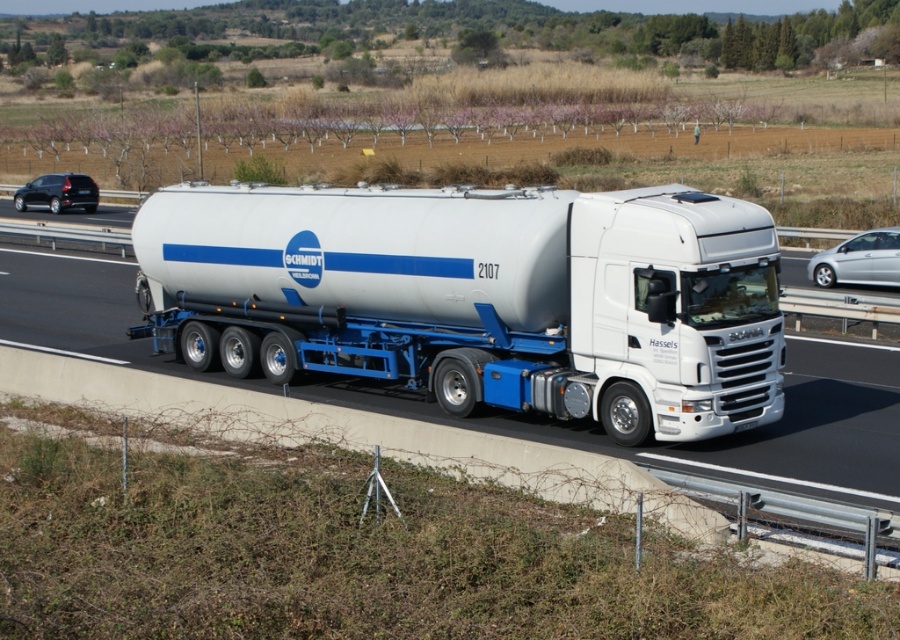
You are a pedestrian standing on the sidewalk and see the white glossy tanker at center and the black matte car at left. Which vehicle is closer to your right side?

The white glossy tanker at center is closer to your right side because it is positioned to the right of the black matte car at left.

You are standing at a safe distance from the tanker truck. You want to know if you can safely approach the point marked at coordinate point (500, 209). The safety guideline requires a minimum distance of 50 feet from the tanker truck. Can you safely approach that point?

The distance between you and the point marked at coordinate point (500, 209) is 50.72 feet, which exceeds the required minimum safety distance of 50 feet. Therefore, you can safely approach that point.